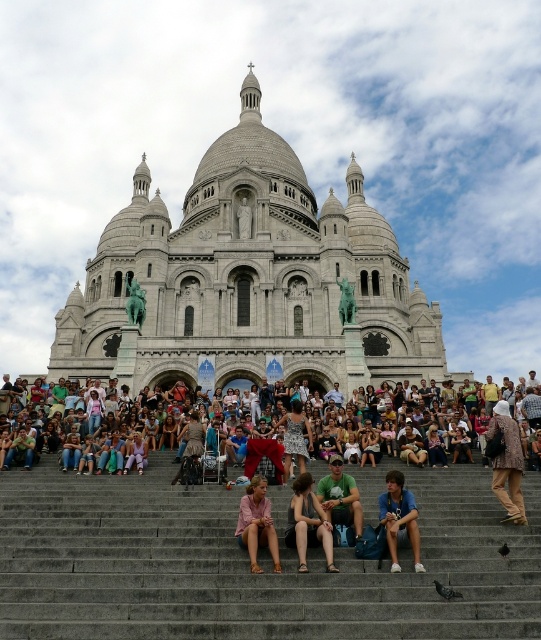
Question: Can you confirm if pink fabric dress at center is positioned to the left of green cotton shirt at center?

Choices:
 (A) no
 (B) yes

Answer: (B)

Question: Which object appears farthest from the camera in this image?

Choices:
 (A) gray stone church at center
 (B) patterned fabric jacket at lower right

Answer: (A)

Question: Which of the following is the closest to the observer?

Choices:
 (A) green cotton shirt at center
 (B) pink fabric dress at center
 (C) gray concrete stairs at center

Answer: (C)

Question: Which of the following is the farthest from the observer?

Choices:
 (A) pos(333,477)
 (B) pos(280,563)
 (C) pos(313,522)

Answer: (A)

Question: Observing the image, what is the correct spatial positioning of pink fabric dress at center in reference to green cotton shirt at center?

Choices:
 (A) below
 (B) above

Answer: (A)

Question: Does blue denim jeans at lower center lie behind green cotton shirt at center?

Choices:
 (A) no
 (B) yes

Answer: (A)